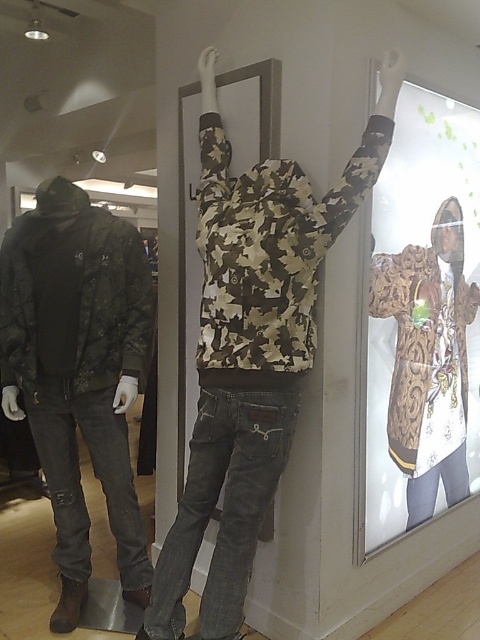
You are a customer in the store looking at the gold metallic jacket at upper right and the camouflage fabric jacket at left. Which jacket is placed higher in the display?

The gold metallic jacket at upper right is positioned over the camouflage fabric jacket at left, so it is placed higher in the display.

You are a customer in the store looking for the camouflage fabric jacket at left. You see the gold metallic jacket at upper right nearby. Which jacket is located to the right of the other?

The gold metallic jacket at upper right is positioned on the right side of camouflage fabric jacket at left.